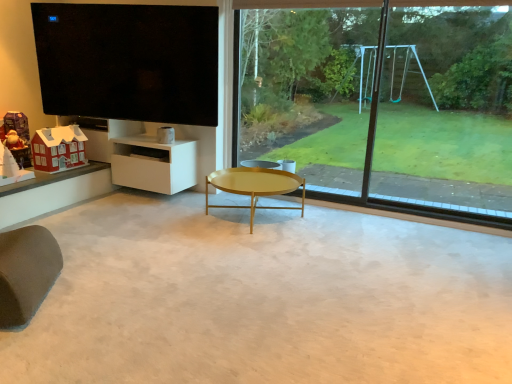
Question: Does black glossy tv at upper left have a lesser height compared to brown fabric swivel chair at lower left?

Choices:
 (A) no
 (B) yes

Answer: (A)

Question: From a real-world perspective, is black glossy tv at upper left over brown fabric swivel chair at lower left?

Choices:
 (A) no
 (B) yes

Answer: (B)

Question: From the image's perspective, is black glossy tv at upper left over brown fabric swivel chair at lower left?

Choices:
 (A) no
 (B) yes

Answer: (B)

Question: Does black glossy tv at upper left have a smaller size compared to brown fabric swivel chair at lower left?

Choices:
 (A) no
 (B) yes

Answer: (A)

Question: Is black glossy tv at upper left looking in the opposite direction of brown fabric swivel chair at lower left?

Choices:
 (A) no
 (B) yes

Answer: (A)

Question: Considering the relative positions of black glossy tv at upper left and brown fabric swivel chair at lower left in the image provided, is black glossy tv at upper left behind brown fabric swivel chair at lower left?

Choices:
 (A) no
 (B) yes

Answer: (B)

Question: Is matte red house at lower left, the 2th toy in the left-to-right sequence, facing away from black glossy tv at upper left?

Choices:
 (A) yes
 (B) no

Answer: (B)

Question: Can you confirm if matte red house at lower left, the 2th toy in the left-to-right sequence, is bigger than black glossy tv at upper left?

Choices:
 (A) yes
 (B) no

Answer: (B)

Question: From a real-world perspective, does matte red house at lower left, the 2th toy in the left-to-right sequence, stand above black glossy tv at upper left?

Choices:
 (A) yes
 (B) no

Answer: (B)

Question: Considering the relative sizes of matte red house at lower left, marked as the first toy in a right-to-left arrangement, and black glossy tv at upper left in the image provided, is matte red house at lower left, marked as the first toy in a right-to-left arrangement, taller than black glossy tv at upper left?

Choices:
 (A) no
 (B) yes

Answer: (A)

Question: From a real-world perspective, is matte red house at lower left, marked as the first toy in a right-to-left arrangement, physically below black glossy tv at upper left?

Choices:
 (A) yes
 (B) no

Answer: (A)

Question: Can you confirm if matte red house at lower left, marked as the first toy in a right-to-left arrangement, is wider than black glossy tv at upper left?

Choices:
 (A) yes
 (B) no

Answer: (A)

Question: Does brown fabric swivel chair at lower left have a greater width compared to black glossy tv at upper left?

Choices:
 (A) yes
 (B) no

Answer: (A)